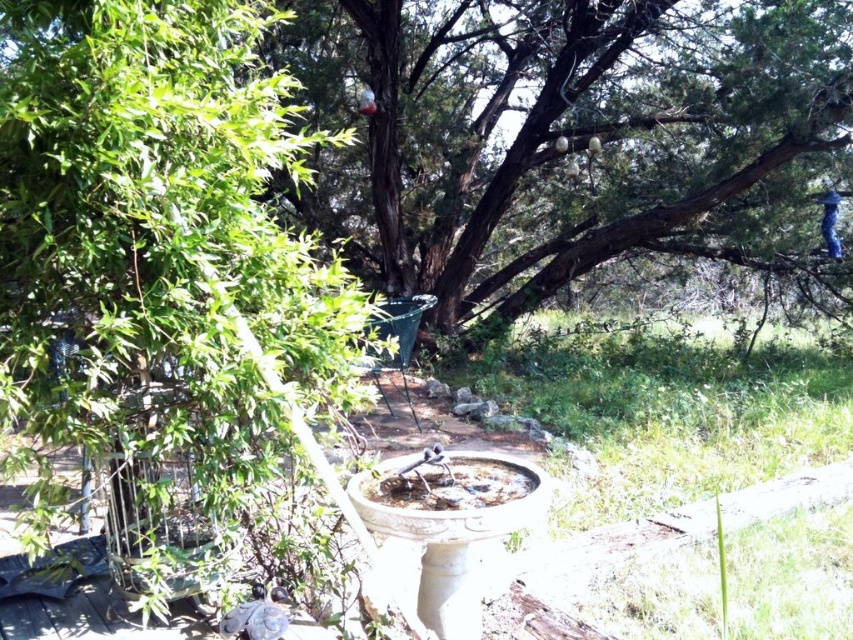
You are a photographer aiming to capture both the green textured tree at center and the smooth gray bird at lower left in a single shot. However, you can only focus on one subject at a time. Which subject should you focus on to ensure the other remains in the background?

You should focus on the green textured tree at center because the smooth gray bird at lower left is behind it, so the bird will naturally be in the background when the tree is in focus.

You are a birdwatcher trying to observe the smooth gray bird at lower left. You notice the green textured tree at center in the background. Which object is wider from your viewpoint?

The green textured tree at center is wider than the smooth gray bird at lower left according to the description.

You are standing in the garden and want to place a new flower pot between the green textured tree at center and the white ceramic bird bath at center. Based on their positions, which object should the flower pot be closer to?

The flower pot should be placed closer to the white ceramic bird bath at center because the green textured tree at center is positioned to the right of the bird bath, meaning the bird bath is to the left of the tree. Therefore, placing the flower pot between them would require it to be closer to the bird bath to maintain the left to right order.